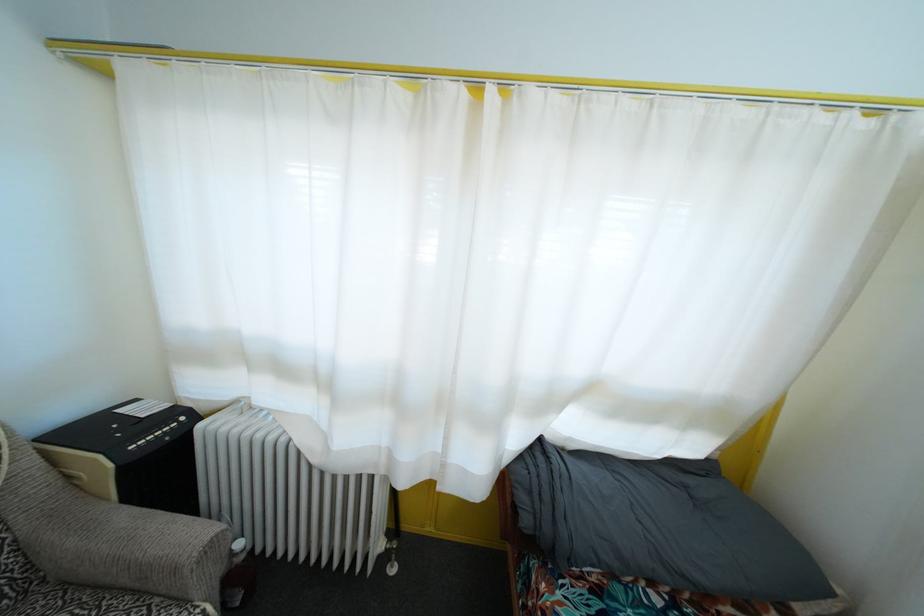
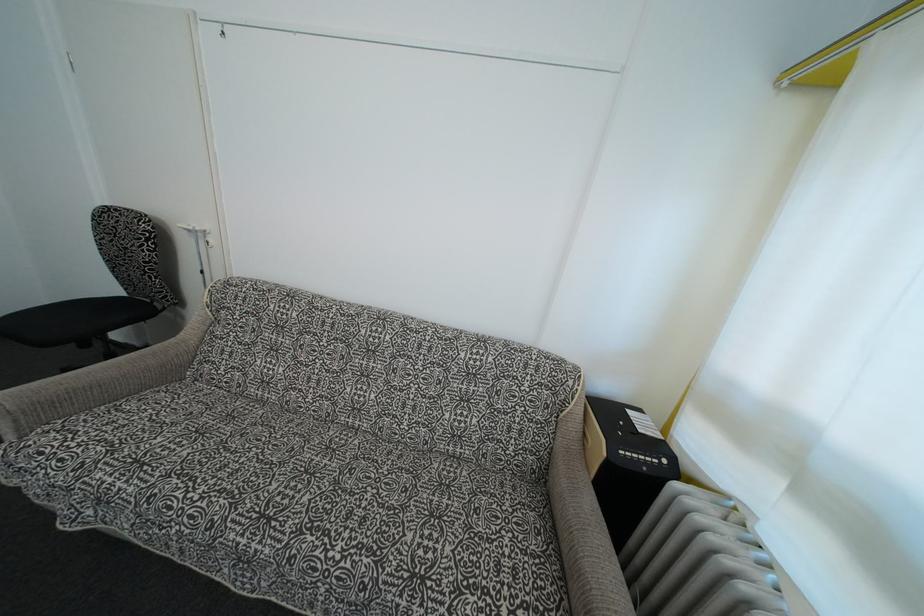
Question: The camera is either moving clockwise (left) or counter-clockwise (right) around the object. The first image is from the beginning of the video and the second image is from the end. Is the camera moving left or right when shooting the video?

Choices:
 (A) Left
 (B) Right

Answer: (B)